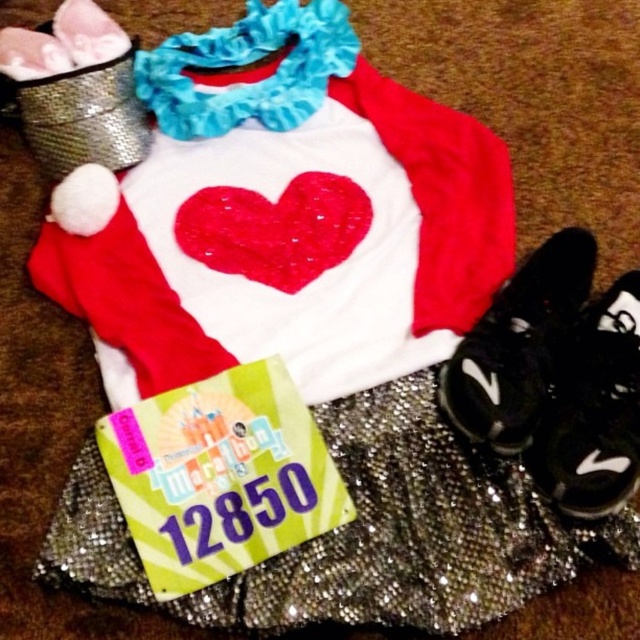
Is point (291, 566) farther from camera compared to point (353, 188)?

No, (291, 566) is in front of (353, 188).

Is glittery sequined ballet skirt at center positioned in front of shiny sequined heart at center?

That is True.

Is point (74, 483) closer to camera compared to point (273, 208)?

Yes, it is.

What are the coordinates of `glittery sequined ballet skirt at center` in the screenshot? It's located at (364, 532).

Is black synthetic shoe at lower right to the left of shiny sequined heart at center from the viewer's perspective?

In fact, black synthetic shoe at lower right is to the right of shiny sequined heart at center.

Can you confirm if black synthetic shoe at lower right is positioned above shiny sequined heart at center?

No, black synthetic shoe at lower right is not above shiny sequined heart at center.

This screenshot has height=640, width=640. I want to click on black synthetic shoe at lower right, so click(516, 346).

What are the coordinates of `black synthetic shoe at lower right` in the screenshot? It's located at (516, 346).

Is point (520, 588) more distant than point (632, 381)?

No, (520, 588) is closer to viewer.

Between point (358, 621) and point (602, 490), which one is positioned behind?

The point (602, 490) is more distant.

Where is `glittery sequined ballet skirt at center`? The height and width of the screenshot is (640, 640). glittery sequined ballet skirt at center is located at coordinates (364, 532).